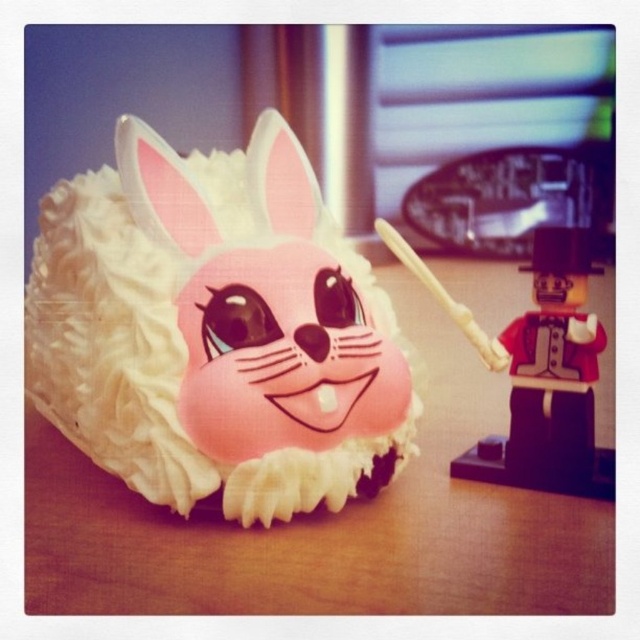
You are at a birthday party and see the pink frosted cake at center and the smooth plastic toy soldier at right. If you want to move the toy soldier closer to the cake, which direction should you move it?

Since the pink frosted cake at center is to the left of the smooth plastic toy soldier at right, you should move the smooth plastic toy soldier at right to the left to bring it closer to the cake.

You are a tiny robot with a height of 0.2 units. You are standing at the point with coordinates point (276, 173) and want to move to the point (561, 234). Is there enough space for you to move forward without hitting anything?

Point (276, 173) is in front of point (561, 234), so the path between them is clear. Since the robot is only 0.2 units tall, there should be enough vertical space for it to move forward without obstruction.